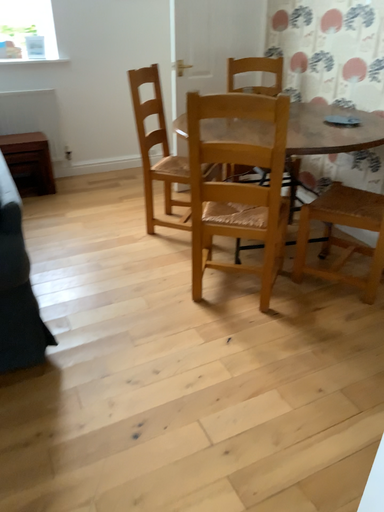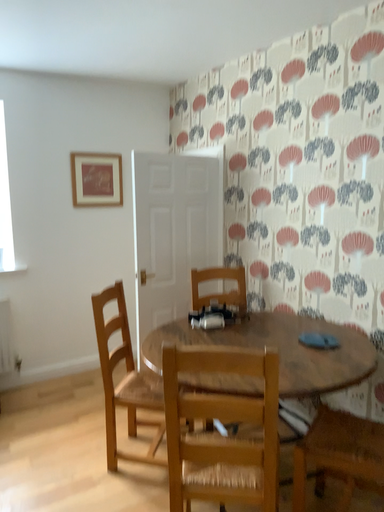
Question: Which way did the camera rotate in the video?

Choices:
 (A) rotated downward
 (B) rotated upward

Answer: (B)